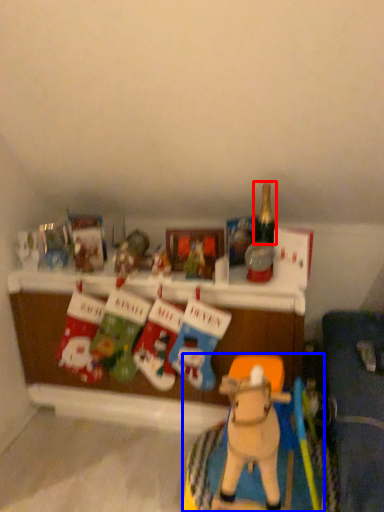
Question: Which of the following is the closest to the observer, bottle (highlighted by a red box) or toy (highlighted by a blue box)?

Choices:
 (A) bottle
 (B) toy

Answer: (B)